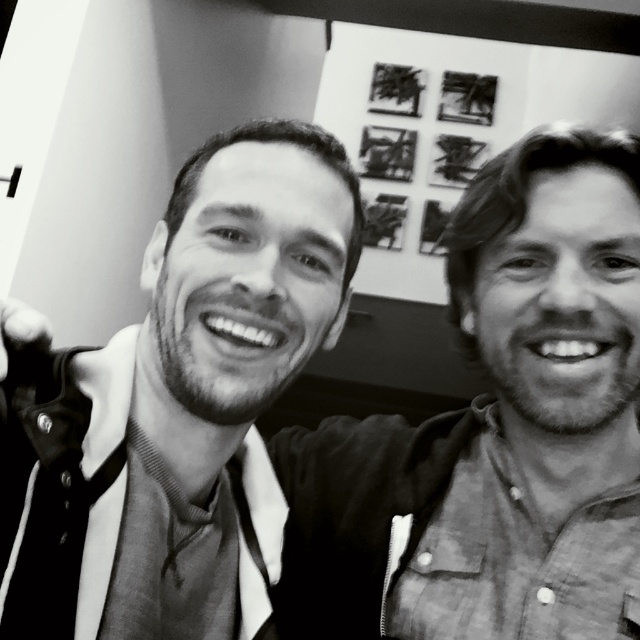
You are a photographer trying to focus on the smooth black shirt at left and the matte black tie at center in the image. Which object is closer to the camera?

The smooth black shirt at left is closer to the camera because it is in front of the matte black tie at center.

You are a photographer trying to adjust the lighting for a portrait. You notice the smooth black shirt at center and the matte black tie at center in the scene. Which object might cast a wider shadow under the same lighting conditions?

The smooth black shirt at center has a larger size compared to the matte black tie at center, so it would cast a wider shadow under the same lighting conditions.